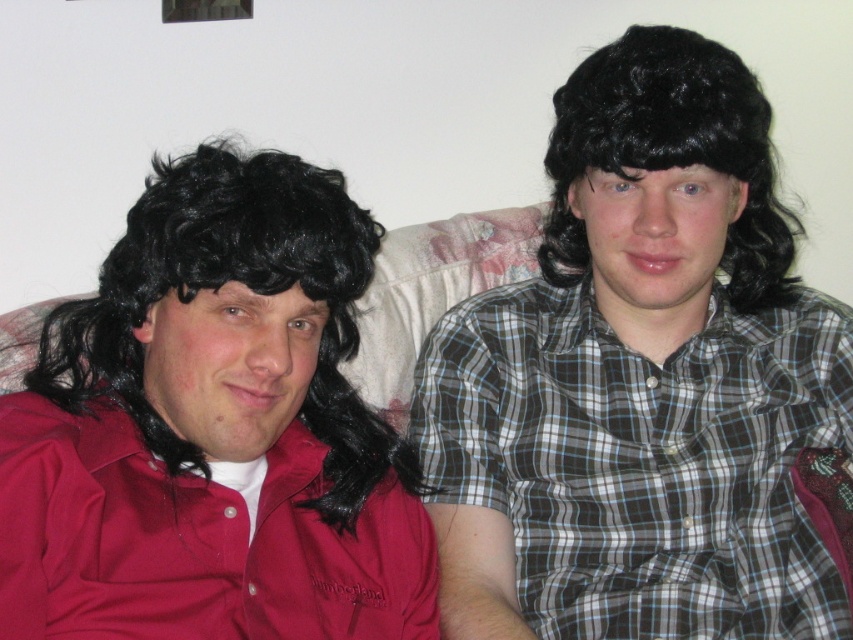
You are a photographer setting up a shoot in the room described. You need to ensure that the matte black wig at left and the plaid shirt at right are both visible in the frame. Based on their positions, which one should you focus on first to ensure both are in focus?

The matte black wig at left is in front of the plaid shirt at right, so you should focus on the matte black wig at left first to ensure both are in focus.

You are standing in the room and want to point to the exact location of the point at coordinates (x=642, y=460). Which object in the scene is this point located on?

The point at coordinates (x=642, y=460) is located on the plaid shirt at right.

Based on the photo, you are designing a hair accessory display and need to place both the matte black wig at left and the black curly wig at upper right on a shelf. The shelf has a width of 1 meter. If the larger wig requires 0.6 meters of space and the smaller wig needs 0.4 meters, will both wigs fit on the shelf without overlapping?

The matte black wig at left is larger than the black curly wig at upper right. Since the total required space is 0.6 meters plus 0.4 meters equals 1.0 meters, which exactly matches the shelf width, both wigs can fit on the shelf without overlapping as long as they are placed side by side.